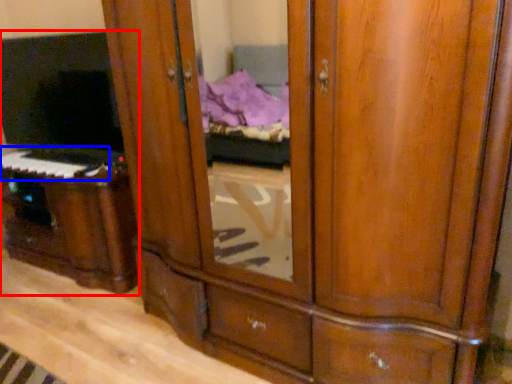
Question: Which object appears closest to the camera in this image, entertainment center (highlighted by a red box) or musical keyboard (highlighted by a blue box)?

Choices:
 (A) entertainment center
 (B) musical keyboard

Answer: (A)